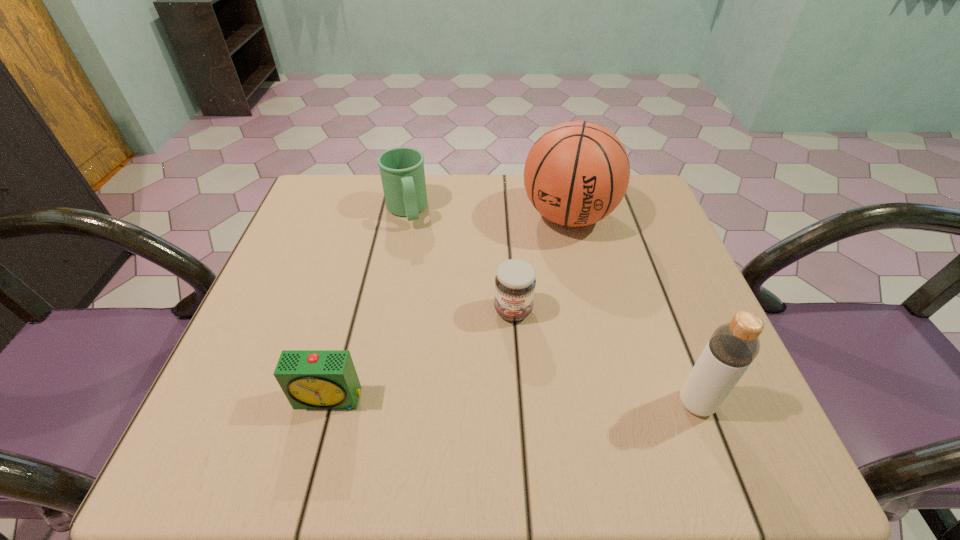
This screenshot has height=540, width=960. In order to click on vacant area that lies between the basketball and the jam in this screenshot , I will do `click(540, 264)`.

This screenshot has height=540, width=960. In order to click on vacant region between the alarm clock and the bottle in this screenshot , I will do `click(513, 401)`.

Locate which object ranks in proximity to the alarm clock. Please provide its 2D coordinates. Your answer should be formatted as a tuple, i.e. [(x, y)], where the tuple contains the x and y coordinates of a point satisfying the conditions above.

[(515, 281)]

You are a GUI agent. You are given a task and a screenshot of the screen. Output one action in this format:
    pyautogui.click(x=<x>, y=<y>)
    Task: Click on the object that is the fourth nearest to the basketball
    The image size is (960, 540).
    Given the screenshot: What is the action you would take?
    pyautogui.click(x=311, y=379)

This screenshot has height=540, width=960. Identify the location of vacant position in the image that satisfies the following two spatial constraints: 1. on the back side of the basketball; 2. on the left side of the jam. (507, 216).

You are a GUI agent. You are given a task and a screenshot of the screen. Output one action in this format:
    pyautogui.click(x=<x>, y=<y>)
    Task: Click on the vacant region that satisfies the following two spatial constraints: 1. on the front side of the third tallest object; 2. on the right side of the jam
    Image resolution: width=960 pixels, height=540 pixels.
    Given the screenshot: What is the action you would take?
    pyautogui.click(x=386, y=310)

Image resolution: width=960 pixels, height=540 pixels. Identify the location of free spot that satisfies the following two spatial constraints: 1. on the front side of the mug; 2. on the right side of the jam. (386, 310).

Where is `vacant space that satisfies the following two spatial constraints: 1. on the front-facing side of the bottle; 2. on the right side of the alarm clock`? This screenshot has height=540, width=960. vacant space that satisfies the following two spatial constraints: 1. on the front-facing side of the bottle; 2. on the right side of the alarm clock is located at coordinates (328, 403).

Image resolution: width=960 pixels, height=540 pixels. I want to click on free location that satisfies the following two spatial constraints: 1. on the front side of the bottle; 2. on the right side of the mug, so click(368, 403).